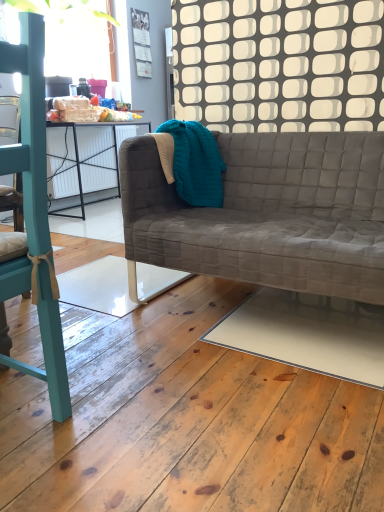
Describe the element at coordinates (196, 162) in the screenshot. This screenshot has width=384, height=512. I see `teal knitted blanket at upper center` at that location.

The height and width of the screenshot is (512, 384). Find the location of `teal knitted blanket at upper center`. teal knitted blanket at upper center is located at coordinates (196, 162).

Describe the element at coordinates (30, 129) in the screenshot. The image size is (384, 512). I see `teal painted wood chair at left` at that location.

This screenshot has height=512, width=384. I want to click on matte paper calendar at upper center, so click(x=141, y=42).

What is the approximate height of matte paper calendar at upper center?

It is 26.50 inches.

Measure the distance between white glossy plywood at lower center and camera.

32.77 inches.

The height and width of the screenshot is (512, 384). What do you see at coordinates (186, 421) in the screenshot?
I see `white glossy plywood at lower center` at bounding box center [186, 421].

You are a GUI agent. You are given a task and a screenshot of the screen. Output one action in this format:
    pyautogui.click(x=<x>, y=<y>)
    Task: Click on the teal knitted blanket at upper center
    The image size is (384, 512).
    Given the screenshot: What is the action you would take?
    pyautogui.click(x=196, y=162)

Which of these two, white glossy plywood at lower center or teal knitted blanket at upper center, stands taller?

Standing taller between the two is teal knitted blanket at upper center.

Identify the location of material on the right of white glossy plywood at lower center. The width and height of the screenshot is (384, 512). (196, 162).

Are white glossy plywood at lower center and teal knitted blanket at upper center far apart?

white glossy plywood at lower center is actually quite close to teal knitted blanket at upper center.

Can you confirm if matte paper calendar at upper center is positioned to the left of textured gray couch at center?

Yes.

Is matte paper calendar at upper center turned away from textured gray couch at center?

That's not correct — matte paper calendar at upper center is not looking away from textured gray couch at center.

Is the position of matte paper calendar at upper center more distant than that of textured gray couch at center?

Yes, it is behind textured gray couch at center.

Is point (143, 12) closer to viewer compared to point (360, 234)?

No, (143, 12) is behind (360, 234).

Considering the relative positions of textured gray couch at center and teal painted wood chair at left in the image provided, is textured gray couch at center to the left of teal painted wood chair at left from the viewer's perspective?

Incorrect, textured gray couch at center is not on the left side of teal painted wood chair at left.

Where is `studio couch located on the right of teal painted wood chair at left`? Image resolution: width=384 pixels, height=512 pixels. studio couch located on the right of teal painted wood chair at left is located at coordinates pos(268,213).

From a real-world perspective, between textured gray couch at center and teal painted wood chair at left, who is vertically higher?

From a 3D spatial view, teal painted wood chair at left is above.

Is textured gray couch at center bigger than teal painted wood chair at left?

Indeed, textured gray couch at center has a larger size compared to teal painted wood chair at left.

Does teal painted wood chair at left have a larger size compared to matte paper calendar at upper center?

Correct, teal painted wood chair at left is larger in size than matte paper calendar at upper center.

How distant is teal painted wood chair at left from matte paper calendar at upper center?

teal painted wood chair at left is 11.14 feet from matte paper calendar at upper center.

Which of these two, teal painted wood chair at left or matte paper calendar at upper center, is thinner?

Thinner between the two is matte paper calendar at upper center.

Can you tell me how much teal knitted blanket at upper center and white glossy plywood at lower center differ in facing direction?

The angle between the facing direction of teal knitted blanket at upper center and the facing direction of white glossy plywood at lower center is 179 degrees.

Which is behind, teal knitted blanket at upper center or white glossy plywood at lower center?

teal knitted blanket at upper center is further from the camera.

You are a GUI agent. You are given a task and a screenshot of the screen. Output one action in this format:
    pyautogui.click(x=<x>, y=<y>)
    Task: Click on the plywood that appears below the teal knitted blanket at upper center (from the image's perspective)
    The height and width of the screenshot is (512, 384).
    Given the screenshot: What is the action you would take?
    pyautogui.click(x=186, y=421)

Which object is wider, matte paper calendar at upper center or white glossy plywood at lower center?

With larger width is white glossy plywood at lower center.

Identify the location of plywood below the matte paper calendar at upper center (from a real-world perspective). (186, 421).

Is point (143, 45) positioned in front of point (283, 396)?

No, it is behind (283, 396).

Is teal knitted blanket at upper center not inside matte paper calendar at upper center?

That's correct, teal knitted blanket at upper center is outside of matte paper calendar at upper center.

From a real-world perspective, which is physically above, teal knitted blanket at upper center or matte paper calendar at upper center?

matte paper calendar at upper center.

Is teal knitted blanket at upper center far away from matte paper calendar at upper center?

Yes.

Which is in front, point (184, 125) or point (151, 77)?

The point (184, 125) is in front.

Where is `plywood lying below the teal knitted blanket at upper center (from the image's perspective)`? The width and height of the screenshot is (384, 512). plywood lying below the teal knitted blanket at upper center (from the image's perspective) is located at coordinates (186, 421).

Locate an element on the screen. Image resolution: width=384 pixels, height=512 pixels. bulletin board above the textured gray couch at center (from a real-world perspective) is located at coordinates (141, 42).

Considering their positions, is teal painted wood chair at left positioned closer to textured gray couch at center than white glossy plywood at lower center?

Based on the image, white glossy plywood at lower center appears to be nearer to textured gray couch at center.

When comparing their distances from white glossy plywood at lower center, does teal knitted blanket at upper center or matte paper calendar at upper center seem further?

matte paper calendar at upper center.

Based on their spatial positions, is white glossy plywood at lower center or matte paper calendar at upper center closer to teal knitted blanket at upper center?

white glossy plywood at lower center is closer to teal knitted blanket at upper center.

Considering their positions, is textured gray couch at center positioned closer to matte paper calendar at upper center than teal painted wood chair at left?

Based on the image, textured gray couch at center appears to be nearer to matte paper calendar at upper center.

Which object lies further to the anchor point white glossy plywood at lower center, teal knitted blanket at upper center or textured gray couch at center?

teal knitted blanket at upper center is positioned further to the anchor white glossy plywood at lower center.

When comparing their distances from matte paper calendar at upper center, does teal painted wood chair at left or textured gray couch at center seem closer?

textured gray couch at center is closer to matte paper calendar at upper center.

When comparing their distances from matte paper calendar at upper center, does teal knitted blanket at upper center or white glossy plywood at lower center seem closer?

teal knitted blanket at upper center is closer to matte paper calendar at upper center.

In the scene shown: Which object lies nearer to the anchor point teal painted wood chair at left, textured gray couch at center or teal knitted blanket at upper center?

The object closer to teal painted wood chair at left is textured gray couch at center.

Locate an element on the screen. The height and width of the screenshot is (512, 384). material positioned between white glossy plywood at lower center and matte paper calendar at upper center from near to far is located at coordinates pos(196,162).

Locate an element on the screen. The width and height of the screenshot is (384, 512). studio couch between teal painted wood chair at left and matte paper calendar at upper center along the z-axis is located at coordinates (268, 213).

Locate an element on the screen. The width and height of the screenshot is (384, 512). studio couch between teal painted wood chair at left and teal knitted blanket at upper center in the front-back direction is located at coordinates (268, 213).

In order to click on studio couch positioned between white glossy plywood at lower center and matte paper calendar at upper center from near to far in this screenshot , I will do `click(268, 213)`.